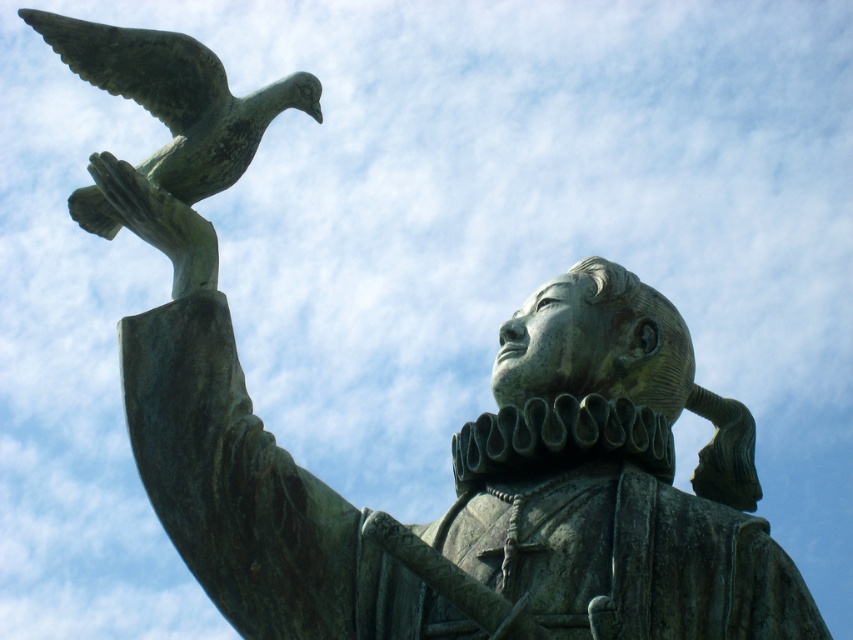
Question: Is green patina bird at upper left further to the viewer compared to bronze statue hand at upper left?

Choices:
 (A) yes
 (B) no

Answer: (A)

Question: Which point is farther to the camera?

Choices:
 (A) (108, 172)
 (B) (161, 40)

Answer: (B)

Question: Is green patina bird at upper left to the left of bronze statue hand at upper left from the viewer's perspective?

Choices:
 (A) no
 (B) yes

Answer: (B)

Question: Can you confirm if green patina bird at upper left is wider than bronze statue hand at upper left?

Choices:
 (A) no
 (B) yes

Answer: (B)

Question: Which point is closer to the camera taking this photo?

Choices:
 (A) (236, 172)
 (B) (125, 196)

Answer: (B)